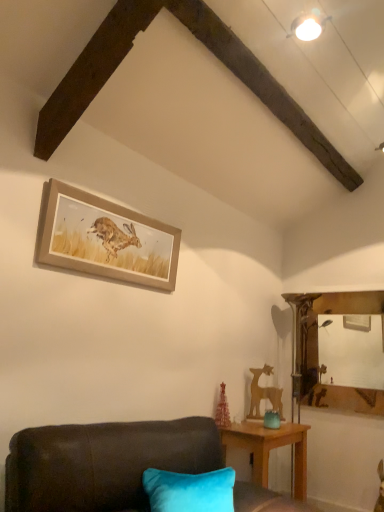
Question: Does wooden deer at right have a greater height compared to wooden framed print of hare at upper center?

Choices:
 (A) no
 (B) yes

Answer: (B)

Question: Does wooden deer at right have a larger size compared to wooden framed print of hare at upper center?

Choices:
 (A) yes
 (B) no

Answer: (B)

Question: From the image's perspective, is wooden deer at right located beneath wooden framed print of hare at upper center?

Choices:
 (A) yes
 (B) no

Answer: (A)

Question: Is wooden deer at right next to wooden framed print of hare at upper center?

Choices:
 (A) yes
 (B) no

Answer: (B)

Question: From a real-world perspective, does wooden deer at right sit lower than wooden framed print of hare at upper center?

Choices:
 (A) yes
 (B) no

Answer: (A)

Question: Is wooden deer at right aimed at wooden framed print of hare at upper center?

Choices:
 (A) yes
 (B) no

Answer: (B)

Question: Is wooden framed print of hare at upper center aimed at velvet dark brown couch at lower left?

Choices:
 (A) yes
 (B) no

Answer: (B)

Question: Can you confirm if wooden framed print of hare at upper center is positioned to the right of velvet dark brown couch at lower left?

Choices:
 (A) no
 (B) yes

Answer: (A)

Question: From the image's perspective, is wooden framed print of hare at upper center on top of velvet dark brown couch at lower left?

Choices:
 (A) yes
 (B) no

Answer: (A)

Question: From a real-world perspective, is wooden framed print of hare at upper center on top of velvet dark brown couch at lower left?

Choices:
 (A) no
 (B) yes

Answer: (B)

Question: Does wooden framed print of hare at upper center have a larger size compared to velvet dark brown couch at lower left?

Choices:
 (A) no
 (B) yes

Answer: (A)

Question: Is wooden framed print of hare at upper center not near velvet dark brown couch at lower left?

Choices:
 (A) yes
 (B) no

Answer: (B)

Question: From a real-world perspective, is teal glass jar at lower right positioned over wooden table at lower right based on gravity?

Choices:
 (A) no
 (B) yes

Answer: (B)